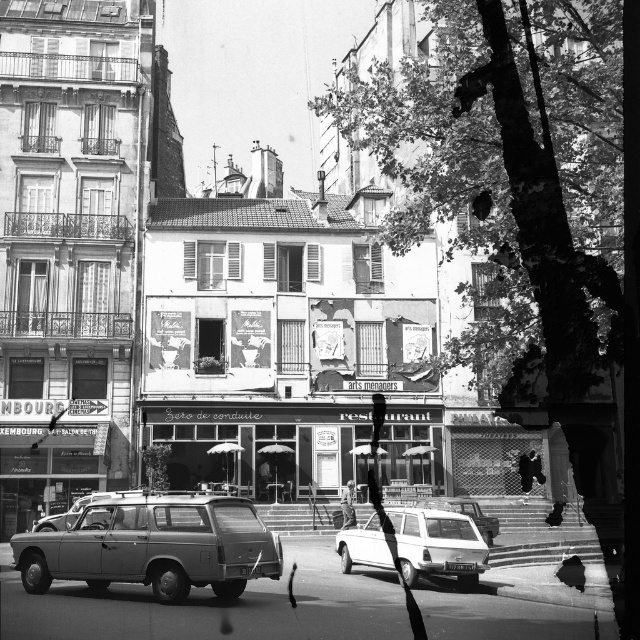
Question: Does metallic gray station wagon at lower left appear under white matte station wagon at center?

Choices:
 (A) yes
 (B) no

Answer: (B)

Question: Which object is closer to the camera taking this photo?

Choices:
 (A) metallic gray station wagon at lower left
 (B) white matte station wagon at center

Answer: (A)

Question: Does metallic gray station wagon at lower left have a larger size compared to white matte station wagon at center?

Choices:
 (A) no
 (B) yes

Answer: (B)

Question: Among these points, which one is nearest to the camera?

Choices:
 (A) (342, 538)
 (B) (205, 532)

Answer: (B)

Question: Can you confirm if metallic gray station wagon at lower left is positioned below white matte station wagon at center?

Choices:
 (A) no
 (B) yes

Answer: (A)